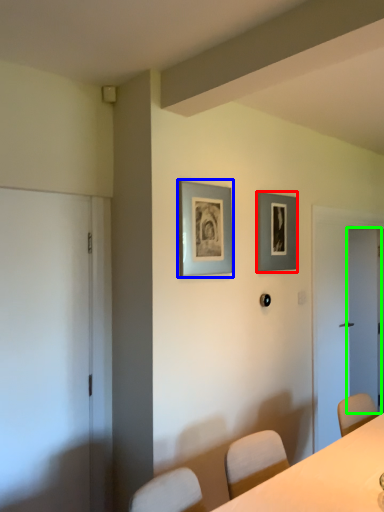
Question: Which object is positioned farthest from picture frame (highlighted by a red box)? Select from picture frame (highlighted by a blue box) and door (highlighted by a green box).

Choices:
 (A) picture frame
 (B) door

Answer: (B)